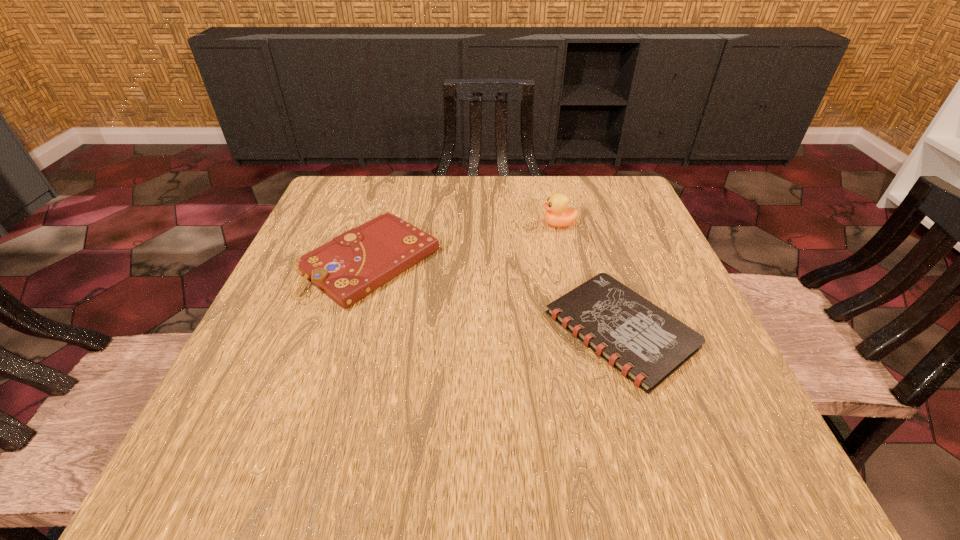
This screenshot has width=960, height=540. I want to click on free space that is in between the duckling and the shorter notebook, so click(589, 277).

Find the location of a particular element. vacant region between the tallest object and the right notebook is located at coordinates (589, 277).

Select which object is the second closest to the right notebook. Please provide its 2D coordinates. Your answer should be formatted as a tuple, i.e. [(x, y)], where the tuple contains the x and y coordinates of a point satisfying the conditions above.

[(351, 266)]

Select which object is the closest to the left notebook. Please provide its 2D coordinates. Your answer should be formatted as a tuple, i.e. [(x, y)], where the tuple contains the x and y coordinates of a point satisfying the conditions above.

[(646, 344)]

I want to click on vacant space that satisfies the following two spatial constraints: 1. on the face of the tallest object; 2. on the front side of the taller notebook, so click(567, 261).

You are a GUI agent. You are given a task and a screenshot of the screen. Output one action in this format:
    pyautogui.click(x=<x>, y=<y>)
    Task: Click on the blank area in the image that satisfies the following two spatial constraints: 1. on the face of the tallest object; 2. on the right side of the right notebook
    The width and height of the screenshot is (960, 540).
    Given the screenshot: What is the action you would take?
    pyautogui.click(x=584, y=330)

Locate an element on the screen. free space that satisfies the following two spatial constraints: 1. on the face of the tallest object; 2. on the front side of the taller notebook is located at coordinates pyautogui.click(x=567, y=261).

Locate an element on the screen. The width and height of the screenshot is (960, 540). free location that satisfies the following two spatial constraints: 1. on the back side of the shortest object; 2. on the face of the tallest object is located at coordinates (587, 224).

Locate an element on the screen. free spot that satisfies the following two spatial constraints: 1. on the face of the tallest object; 2. on the left side of the right notebook is located at coordinates [584, 330].

Image resolution: width=960 pixels, height=540 pixels. Find the location of `vacant area in the image that satisfies the following two spatial constraints: 1. on the face of the right notebook; 2. on the left side of the tallest object`. vacant area in the image that satisfies the following two spatial constraints: 1. on the face of the right notebook; 2. on the left side of the tallest object is located at coordinates (584, 330).